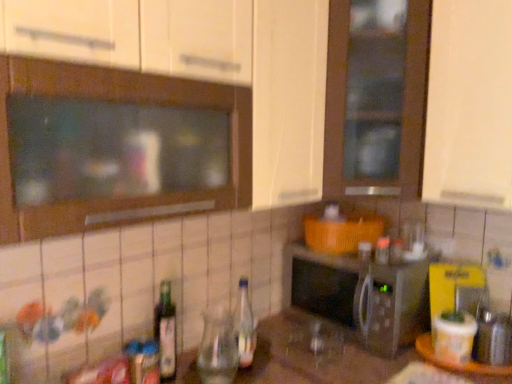
Question: Does green glass bottle at lower left, arranged as the 1th bottle when viewed from the left, have a lesser width compared to clear glass bottle at center, the 2th bottle viewed from the left?

Choices:
 (A) no
 (B) yes

Answer: (B)

Question: From the image's perspective, is green glass bottle at lower left, which is the second bottle from right to left, located above clear glass bottle at center, the 2th bottle viewed from the left?

Choices:
 (A) yes
 (B) no

Answer: (B)

Question: Does green glass bottle at lower left, arranged as the 1th bottle when viewed from the left, have a lesser height compared to clear glass bottle at center, placed as the 1th bottle when sorted from right to left?

Choices:
 (A) no
 (B) yes

Answer: (A)

Question: Considering the relative sizes of green glass bottle at lower left, arranged as the 1th bottle when viewed from the left, and clear glass bottle at center, the 2th bottle viewed from the left, in the image provided, is green glass bottle at lower left, arranged as the 1th bottle when viewed from the left, taller than clear glass bottle at center, the 2th bottle viewed from the left,?

Choices:
 (A) yes
 (B) no

Answer: (A)

Question: Is clear glass bottle at center, the 2th bottle viewed from the left, inside green glass bottle at lower left, which is the second bottle from right to left?

Choices:
 (A) no
 (B) yes

Answer: (A)

Question: Is the position of green glass bottle at lower left, which is the second bottle from right to left, more distant than that of clear glass bottle at center, the 2th bottle viewed from the left?

Choices:
 (A) yes
 (B) no

Answer: (B)

Question: Could you tell me if wooden tray at lower right is facing clear glass bottle at center, the 2th bottle viewed from the left?

Choices:
 (A) yes
 (B) no

Answer: (B)

Question: Is wooden tray at lower right directly adjacent to clear glass bottle at center, placed as the 1th bottle when sorted from right to left?

Choices:
 (A) yes
 (B) no

Answer: (B)

Question: Is wooden tray at lower right not close to clear glass bottle at center, placed as the 1th bottle when sorted from right to left?

Choices:
 (A) yes
 (B) no

Answer: (B)

Question: Is wooden tray at lower right to the right of clear glass bottle at center, placed as the 1th bottle when sorted from right to left, from the viewer's perspective?

Choices:
 (A) yes
 (B) no

Answer: (A)

Question: From a real-world perspective, does wooden tray at lower right sit lower than clear glass bottle at center, the 2th bottle viewed from the left?

Choices:
 (A) no
 (B) yes

Answer: (B)

Question: Is wooden tray at lower right taller than clear glass bottle at center, placed as the 1th bottle when sorted from right to left?

Choices:
 (A) yes
 (B) no

Answer: (B)

Question: Is clear glass bottle at center, placed as the 1th bottle when sorted from right to left, at the left side of green glass bottle at lower left, which is the second bottle from right to left?

Choices:
 (A) yes
 (B) no

Answer: (B)